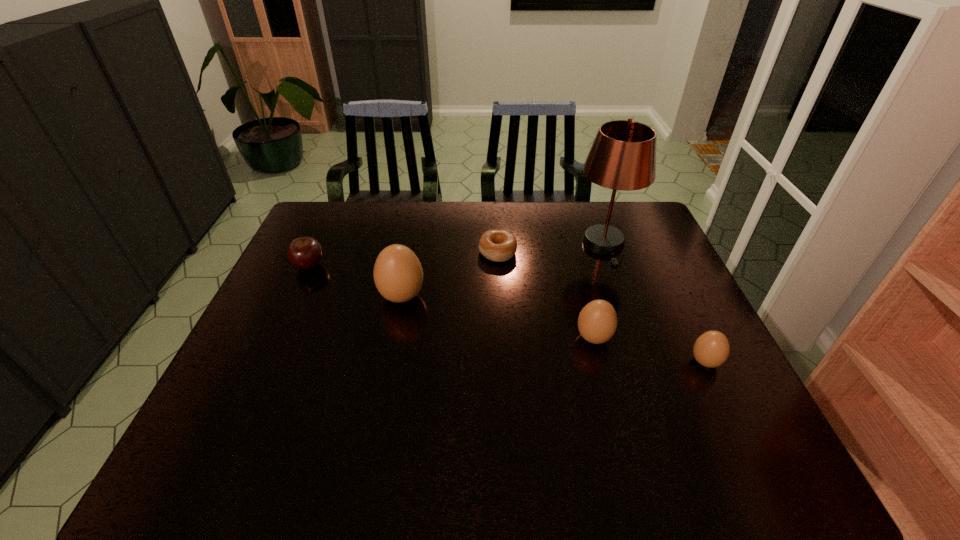
The width and height of the screenshot is (960, 540). In order to click on lampshade located at the right edge in this screenshot , I will do `click(623, 155)`.

In order to click on object at the far right corner in this screenshot , I will do `click(623, 155)`.

Where is `vacant area at the far edge`? vacant area at the far edge is located at coordinates (493, 204).

Identify the location of vacant space at the right edge of the desktop. (715, 373).

What are the coordinates of `vacant area at the far left corner` in the screenshot? It's located at (334, 207).

You are a GUI agent. You are given a task and a screenshot of the screen. Output one action in this format:
    pyautogui.click(x=<x>, y=<y>)
    Task: Click on the free spot at the near left corner of the desktop
    Image resolution: width=960 pixels, height=540 pixels.
    Given the screenshot: What is the action you would take?
    pyautogui.click(x=252, y=418)

The image size is (960, 540). In the image, there is a desktop. Find the location of `vacant space at the near right corner`. vacant space at the near right corner is located at coordinates (701, 406).

The width and height of the screenshot is (960, 540). I want to click on vacant space that is in between the farthest boiled egg and the shortest object, so click(449, 274).

Identify the location of free space that is in between the shortest boiled egg and the fifth object from right to left. The height and width of the screenshot is (540, 960). (554, 329).

At what (x,y) coordinates should I click in order to perform the action: click on empty location between the tallest object and the leftmost boiled egg. Please return your answer as a coordinate pair (x, y). This screenshot has height=540, width=960. Looking at the image, I should click on (503, 271).